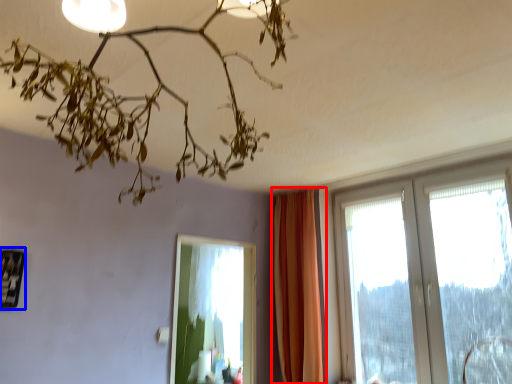
Question: Which of the following is the closest to the observer, curtain (highlighted by a red box) or picture frame (highlighted by a blue box)?

Choices:
 (A) curtain
 (B) picture frame

Answer: (B)